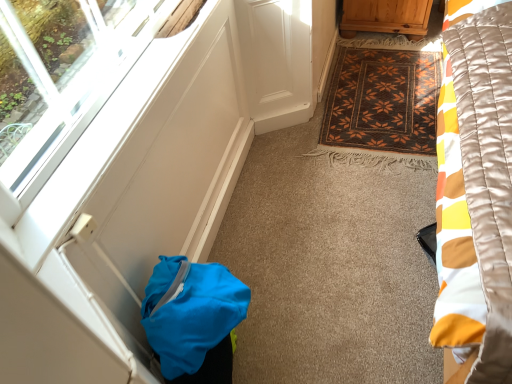
Image resolution: width=512 pixels, height=384 pixels. In order to click on free space above blue fabric bag at lower left (from a real-world perspective) in this screenshot , I will do `click(174, 297)`.